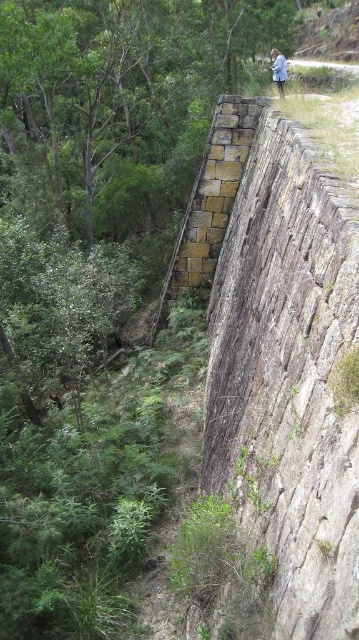
Does green leafy tree at upper left have a lesser height compared to blue cotton shirt at upper center?

Incorrect, green leafy tree at upper left's height does not fall short of blue cotton shirt at upper center's.

Is point (266, 33) closer to camera compared to point (282, 58)?

No, (266, 33) is behind (282, 58).

Which is behind, point (178, 193) or point (281, 84)?

The point (178, 193) is more distant.

Find the location of `green leafy tree at upper left`. green leafy tree at upper left is located at coordinates (119, 97).

Which of these two, brown stone wall at center or green leafy tree at upper left, stands shorter?

With less height is brown stone wall at center.

Is brown stone wall at center wider than green leafy tree at upper left?

No.

Is point (351, 301) farther from camera compared to point (50, 150)?

No, it is in front of (50, 150).

I want to click on brown stone wall at center, so click(x=287, y=378).

Is point (221, 392) farther from viewer compared to point (276, 52)?

No.

Can you confirm if brown stone wall at center is positioned below blue cotton shirt at upper center?

Correct, brown stone wall at center is located below blue cotton shirt at upper center.

Find the location of a particular element. brown stone wall at center is located at coordinates (287, 378).

You are a GUI agent. You are given a task and a screenshot of the screen. Output one action in this format:
    pyautogui.click(x=<x>, y=<y>)
    Task: Click on the brown stone wall at center
    The width and height of the screenshot is (359, 640).
    Given the screenshot: What is the action you would take?
    pyautogui.click(x=287, y=378)